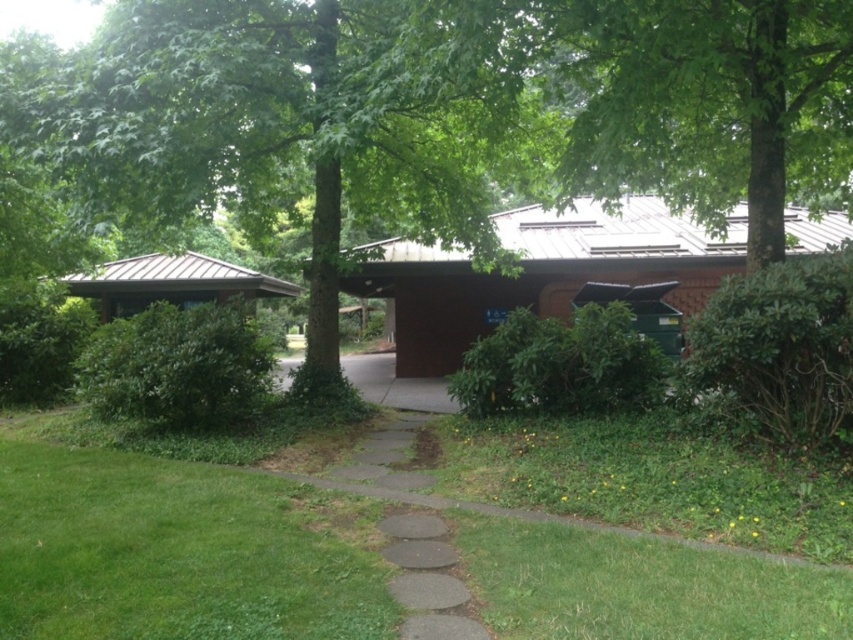
From the picture: You are standing in the outdoor scene and want to walk from the green grass at lower left to the green leafy tree at center. Which direction should you move to get closer to the tree?

To get closer to the green leafy tree at center, you should move forward since it is further away from you than the green grass at lower left.

You are standing at the point marked as point (171, 554) in the image. What is the color of the ground beneath your feet?

The ground beneath your feet is green grass at lower left.

You are planning to park your car on the brown concrete driveway at center. However, there is a green leafy tree at center nearby. Will the tree block sunlight from reaching the driveway during the day?

The green leafy tree at center is thinner than the brown concrete driveway at center, so it is unlikely to block sunlight from reaching the driveway during the day.